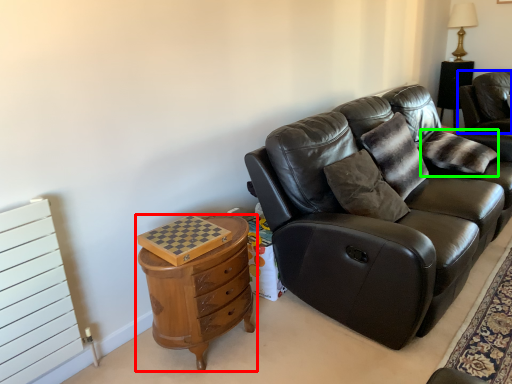
Question: Which object is positioned closest to chest of drawers (highlighted by a red box)? Select from chair (highlighted by a blue box) and pillow (highlighted by a green box).

Choices:
 (A) chair
 (B) pillow

Answer: (B)